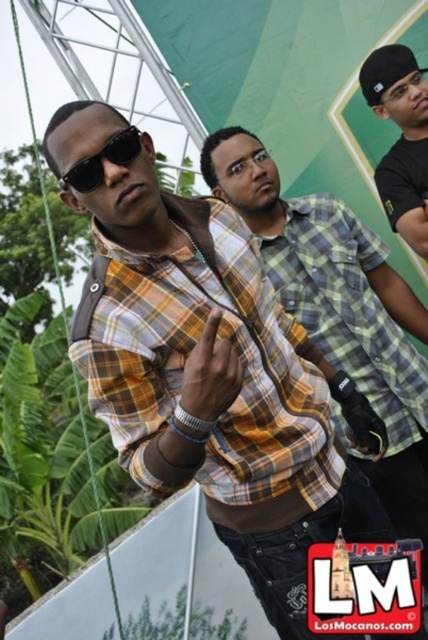
Question: Based on their relative distances, which object is nearer to the black matte sunglasses at center?

Choices:
 (A) black matte cap at upper right
 (B) yellow plaid shirt at center

Answer: (B)

Question: Does black matte cap at upper right appear over black matte sunglasses at center?

Choices:
 (A) no
 (B) yes

Answer: (B)

Question: Among these objects, which one is farthest from the camera?

Choices:
 (A) yellow plaid shirt at center
 (B) black matte cap at upper right
 (C) black matte sunglasses at center

Answer: (B)

Question: Considering the relative positions of black matte cap at upper right and black matte sunglasses at center in the image provided, where is black matte cap at upper right located with respect to black matte sunglasses at center?

Choices:
 (A) right
 (B) left

Answer: (A)

Question: Which point is farther to the camera?

Choices:
 (A) (127, 144)
 (B) (255, 497)
 (C) (383, 51)

Answer: (C)

Question: Is black matte cap at upper right behind black matte sunglasses at center?

Choices:
 (A) no
 (B) yes

Answer: (B)